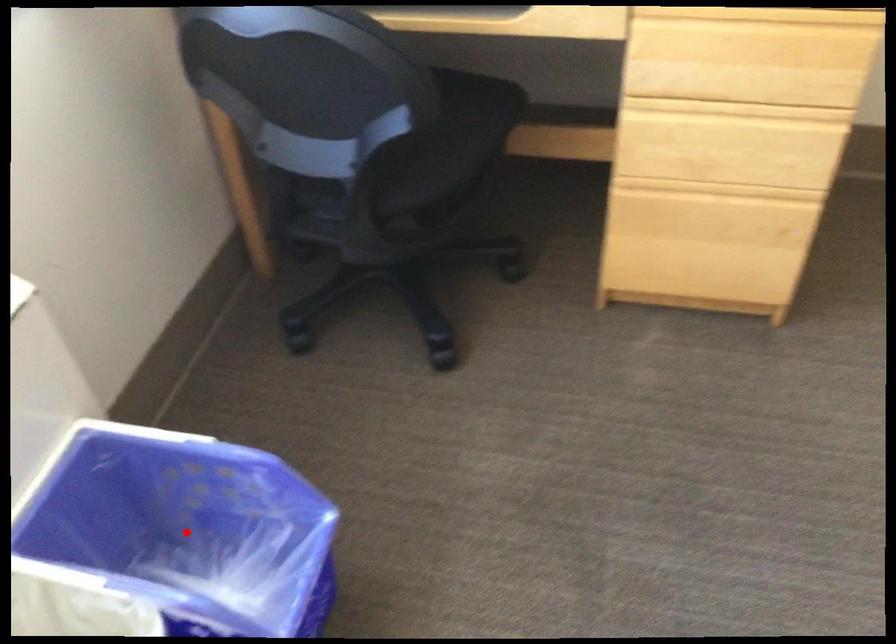
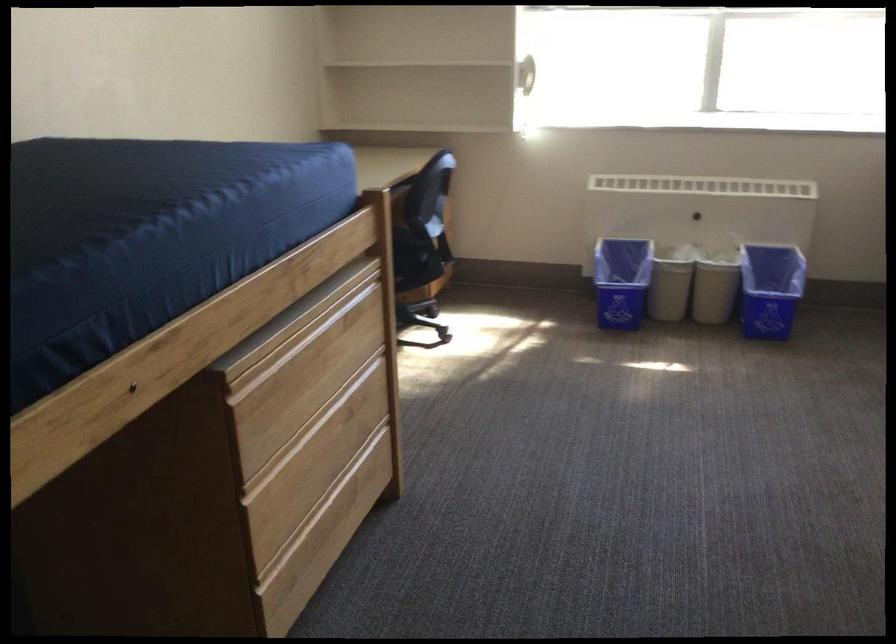
In the second image, find the point that corresponds to the highlighted location in the first image.

(770, 289)